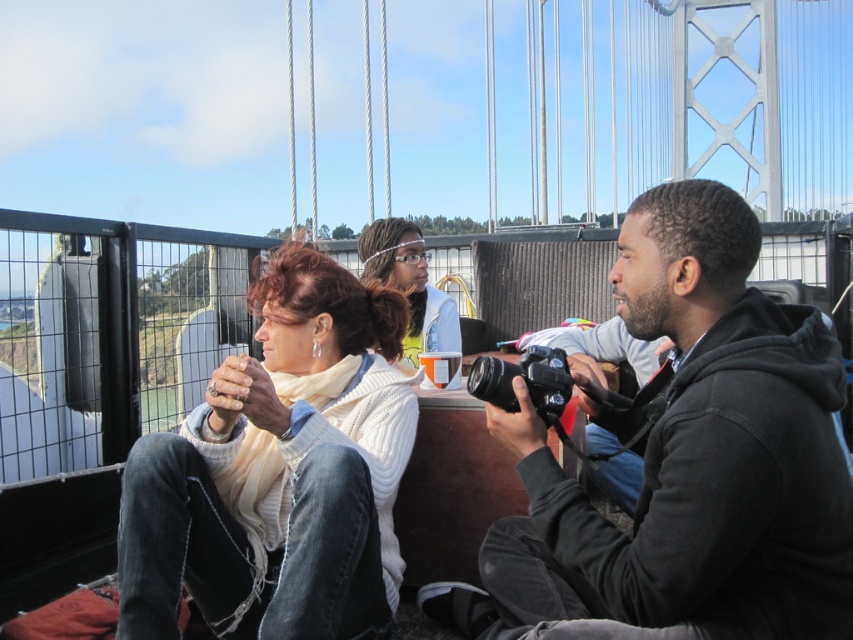
Consider the image. Who is lower down, white knit sweater at center or white matte hairband at center?

white knit sweater at center is below.

Looking at this image, does white knit sweater at center have a smaller size compared to white matte hairband at center?

Correct, white knit sweater at center occupies less space than white matte hairband at center.

I want to click on white knit sweater at center, so click(x=279, y=474).

Is black matte camera at center below white matte hairband at center?

Correct, black matte camera at center is located below white matte hairband at center.

Does point (625, 301) come closer to viewer compared to point (432, 348)?

Yes, point (625, 301) is closer to viewer.

Where is `black matte camera at center`? This screenshot has width=853, height=640. black matte camera at center is located at coordinates 683,461.

Looking at this image, between black matte camera at center and white knit sweater at center, which one is positioned lower?

black matte camera at center

Does black matte camera at center have a lesser height compared to white knit sweater at center?

No.

The width and height of the screenshot is (853, 640). Describe the element at coordinates (683, 461) in the screenshot. I see `black matte camera at center` at that location.

The height and width of the screenshot is (640, 853). Identify the location of black matte camera at center. (683, 461).